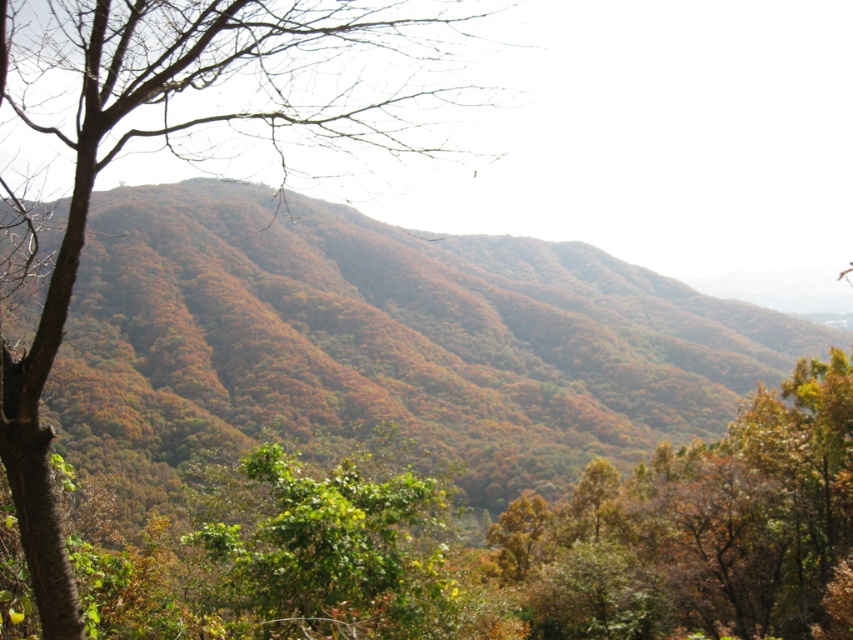
Is bare branches at left positioned in front of green leafy tree at center?

Yes.

You are a GUI agent. You are given a task and a screenshot of the screen. Output one action in this format:
    pyautogui.click(x=<x>, y=<y>)
    Task: Click on the bare branches at left
    This screenshot has height=640, width=853.
    Given the screenshot: What is the action you would take?
    pyautogui.click(x=178, y=152)